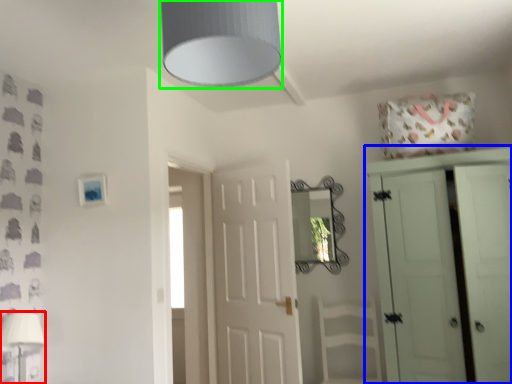
Question: Considering the real-world distances, which object is farthest from table lamp (highlighted by a red box)? cupboard (highlighted by a blue box) or light fixture (highlighted by a green box)?

Choices:
 (A) cupboard
 (B) light fixture

Answer: (A)